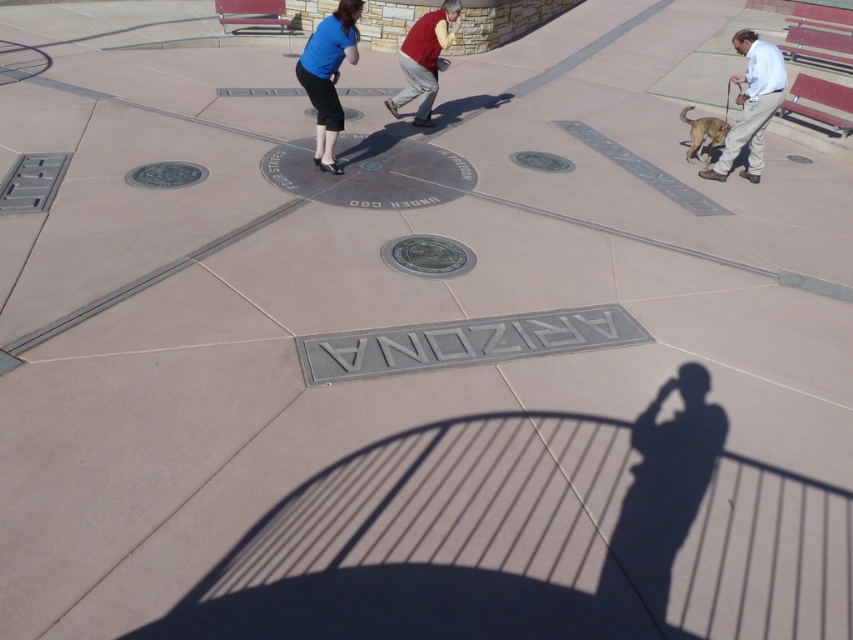
You are standing at the Four Corners Monument and want to take a photo that includes both the matte blue skirt at upper center and the light beige pants at right. How far apart are these two items in the scene?

The matte blue skirt at upper center and the light beige pants at right are 13.08 feet apart.

You are standing at the Four Corners Monument and see a person wearing a matte blue skirt at upper center and another wearing light beige pants at right. Which person is positioned to the left side of the monument?

The matte blue skirt at upper center is to the left of light beige pants at right, so the person wearing the matte blue skirt at upper center is positioned to the left side of the monument.

You are a tour guide leading a group to the Four Corners Monument. A tourist wearing a matte red shirt at center wants to take a photo with their friend wearing light beige pants at right. The tourist has a camera with a 50mm lens. Can they both fit in the frame if they stand 3 meters apart from each other?

The distance between the matte red shirt at center and light beige pants at right is 3.13 meters. Since the tourists want to stand 3 meters apart, which is less than the existing distance, they can move closer to each other so that they are within the 3 meters required for the camera lens to capture both in the frame.